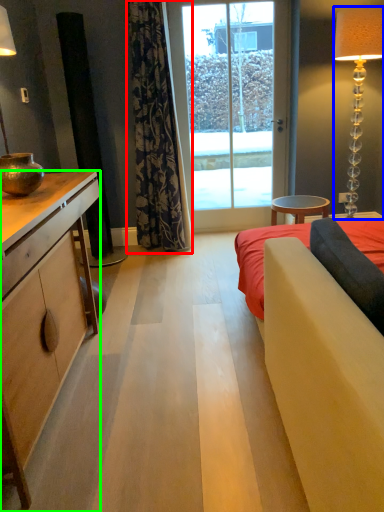
Question: Which object is positioned closest to curtain (highlighted by a red box)? Select from lamp (highlighted by a blue box) and cabinetry (highlighted by a green box).

Choices:
 (A) lamp
 (B) cabinetry

Answer: (B)